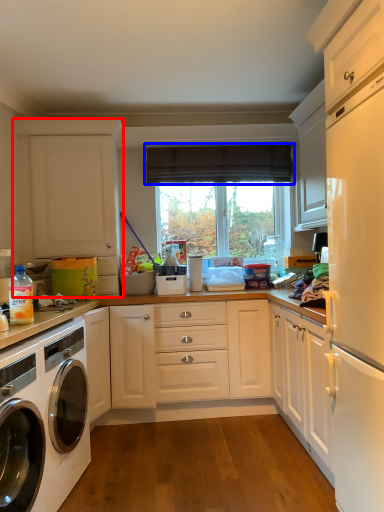
Question: Which object appears farthest to the camera in this image, cabinetry (highlighted by a red box) or curtain (highlighted by a blue box)?

Choices:
 (A) cabinetry
 (B) curtain

Answer: (B)